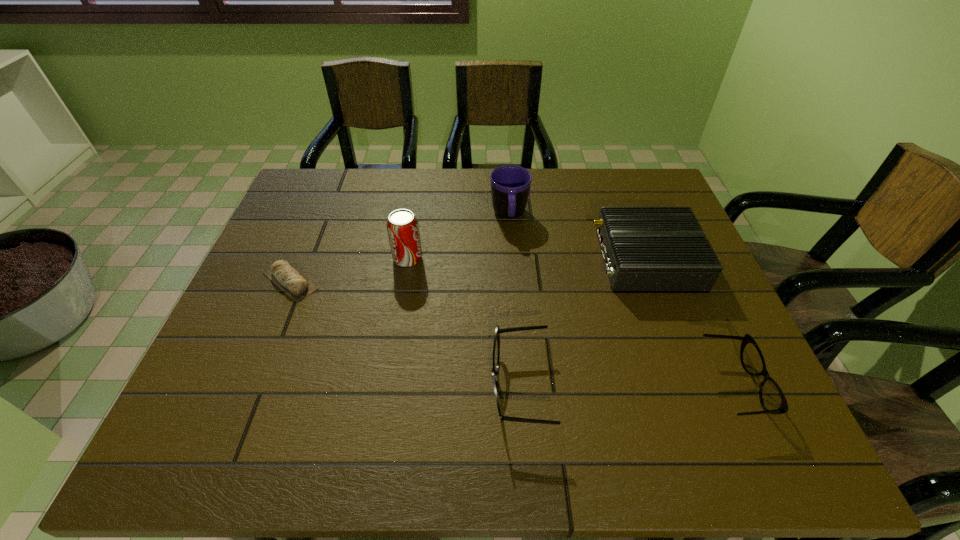
What are the coordinates of `object that is the second nearest to the fifth object from right to left` in the screenshot? It's located at (510, 185).